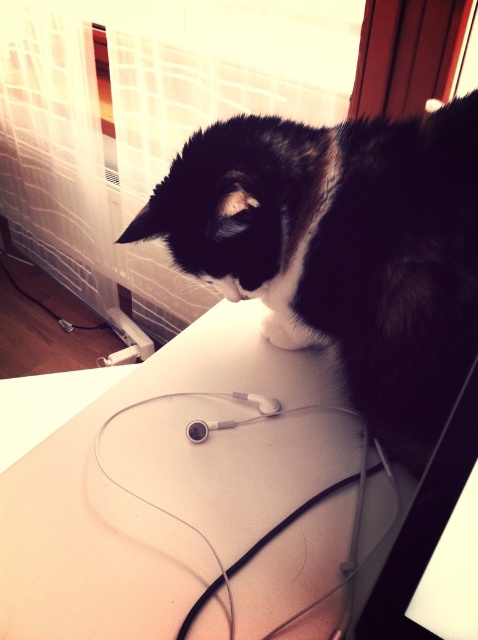
Between white matte computer desk at center and black glossy monitor at upper right, which one is positioned lower?

white matte computer desk at center

Is point (96, 403) positioned in front of point (364, 628)?

No.

This screenshot has width=478, height=640. Identify the location of white matte computer desk at center. (129, 497).

Is white matte computer desk at center taller than black fur cat at upper center?

No.

Can you confirm if white matte computer desk at center is positioned to the right of black fur cat at upper center?

No, white matte computer desk at center is not to the right of black fur cat at upper center.

What do you see at coordinates (129, 497) in the screenshot? The image size is (478, 640). I see `white matte computer desk at center` at bounding box center [129, 497].

You are a GUI agent. You are given a task and a screenshot of the screen. Output one action in this format:
    pyautogui.click(x=<x>, y=<y>)
    Task: Click on the white matte computer desk at center
    The height and width of the screenshot is (640, 478).
    Given the screenshot: What is the action you would take?
    pyautogui.click(x=129, y=497)

The image size is (478, 640). Describe the element at coordinates (343, 248) in the screenshot. I see `black fur cat at upper center` at that location.

Does black fur cat at upper center have a greater width compared to black glossy monitor at upper right?

Indeed, black fur cat at upper center has a greater width compared to black glossy monitor at upper right.

Locate an element on the screen. This screenshot has width=478, height=640. black fur cat at upper center is located at coordinates pyautogui.click(x=343, y=248).